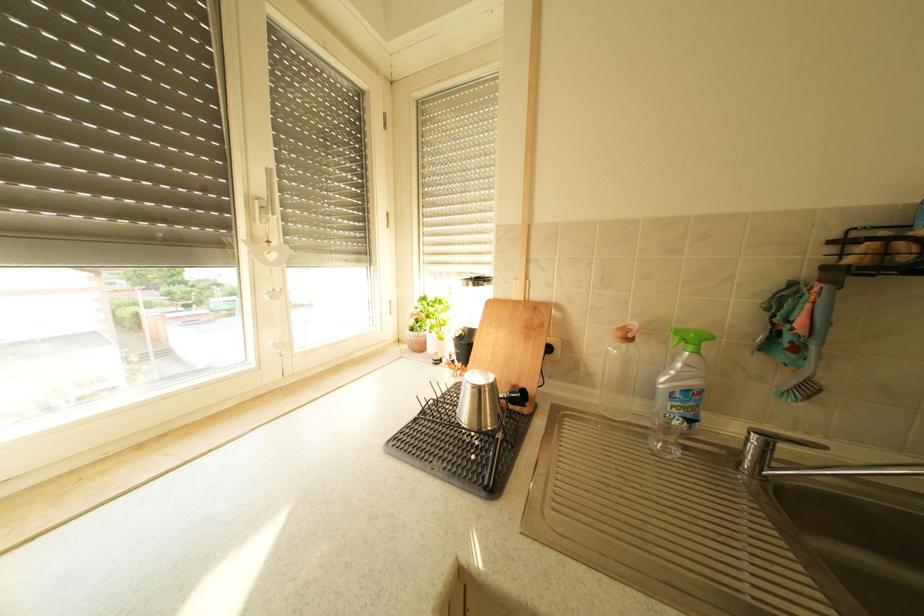
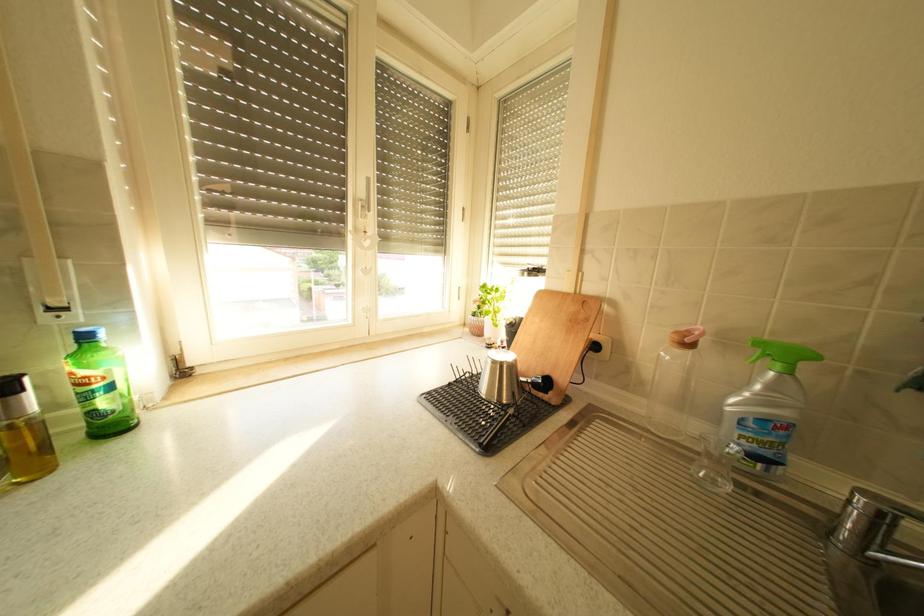
Question: What movement of the cameraman would produce the second image?

Choices:
 (A) Left
 (B) Right
 (C) Forward
 (D) Backward

Answer: (B)